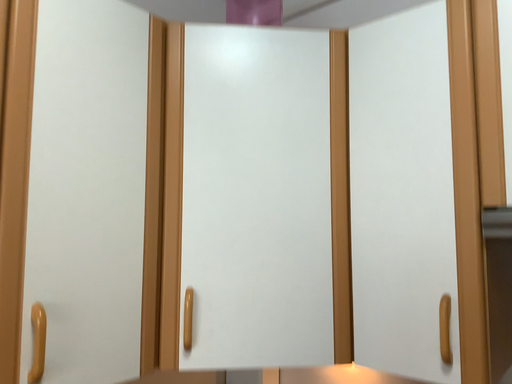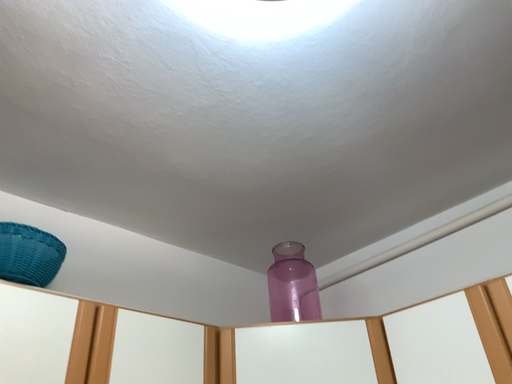
Question: Which way did the camera rotate in the video?

Choices:
 (A) rotated upward
 (B) rotated downward

Answer: (A)